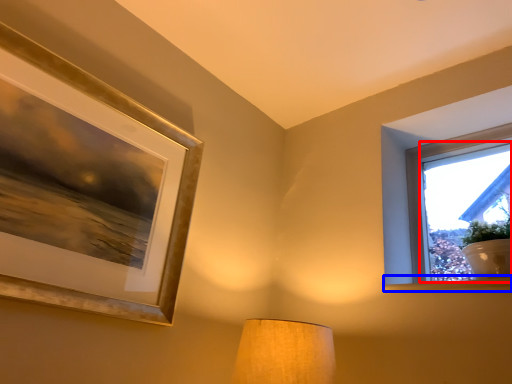
Question: Which object appears farthest to the camera in this image, window screen (highlighted by a red box) or window sill (highlighted by a blue box)?

Choices:
 (A) window screen
 (B) window sill

Answer: (B)